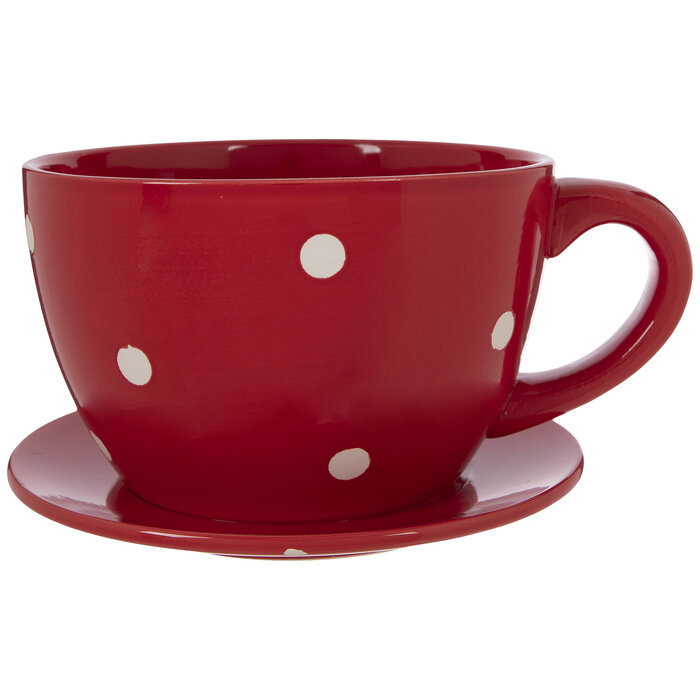
The image size is (700, 700). In order to click on cup in this screenshot , I will do pyautogui.click(x=400, y=407).